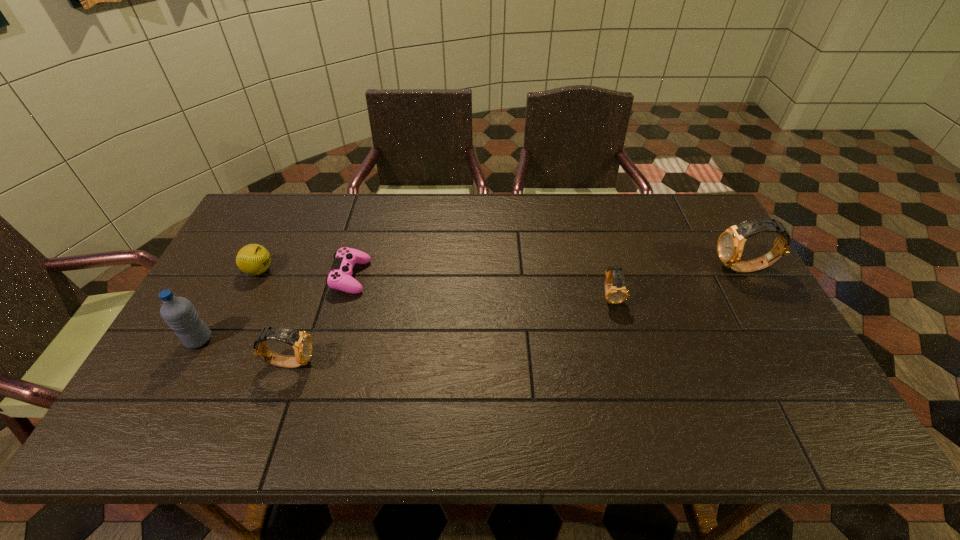
Image resolution: width=960 pixels, height=540 pixels. Find the location of `vacant space located on the face of the second farthest watch`. vacant space located on the face of the second farthest watch is located at coordinates (623, 342).

You are a GUI agent. You are given a task and a screenshot of the screen. Output one action in this format:
    pyautogui.click(x=<x>, y=<y>)
    Task: Click on the free space located on the face of the farthest watch
    
    Given the screenshot: What is the action you would take?
    pyautogui.click(x=662, y=269)

Image resolution: width=960 pixels, height=540 pixels. I want to click on vacant space located on the face of the farthest watch, so click(x=659, y=269).

This screenshot has height=540, width=960. I want to click on vacant area situated 0.280m on the face of the farthest watch, so click(x=622, y=269).

Find the location of `vacant space situated on the right of the control`. vacant space situated on the right of the control is located at coordinates pyautogui.click(x=405, y=276).

Locate an element on the screen. The height and width of the screenshot is (540, 960). vacant space situated on the logo side of the softball is located at coordinates (291, 271).

At what (x,y) coordinates should I click in order to perform the action: click on free space located on the right of the water bottle. Please return your answer as a coordinate pair (x, y). The width and height of the screenshot is (960, 540). Looking at the image, I should click on (338, 340).

The height and width of the screenshot is (540, 960). What are the coordinates of `object positioned at the near edge` in the screenshot? It's located at (301, 342).

Where is `softball at the left edge`? softball at the left edge is located at coordinates (253, 259).

Find the location of `water bottle at the left edge`. water bottle at the left edge is located at coordinates (179, 313).